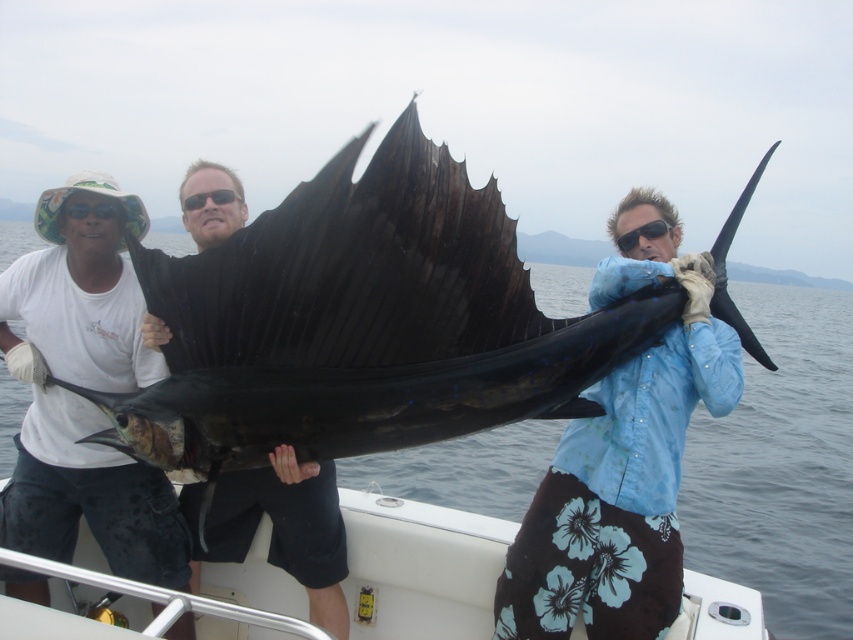
You are a photographer trying to capture the shiny black sailfish at center and the blue water at center. Which object is positioned closer to you in the scene?

The shiny black sailfish at center is closer to the viewer than the blue water at center.